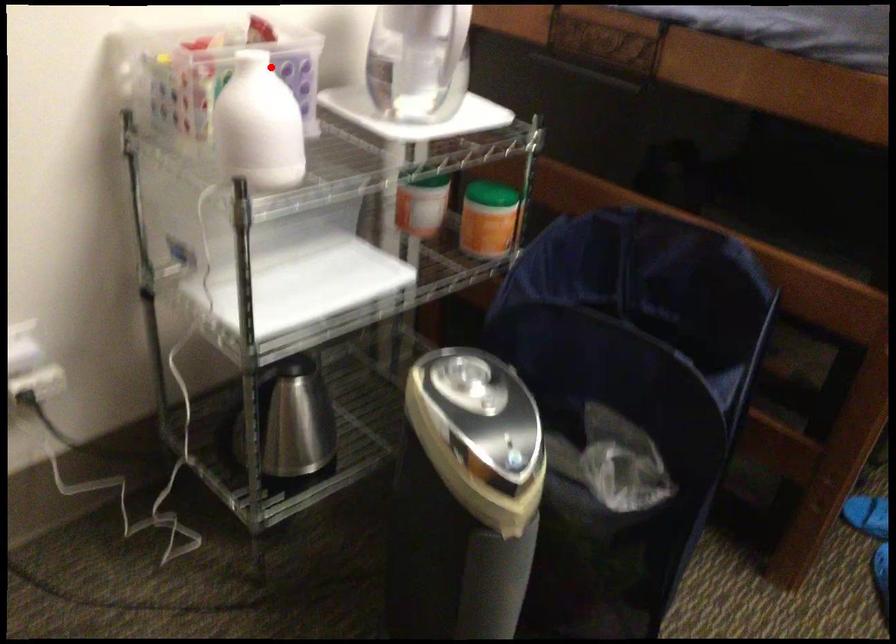
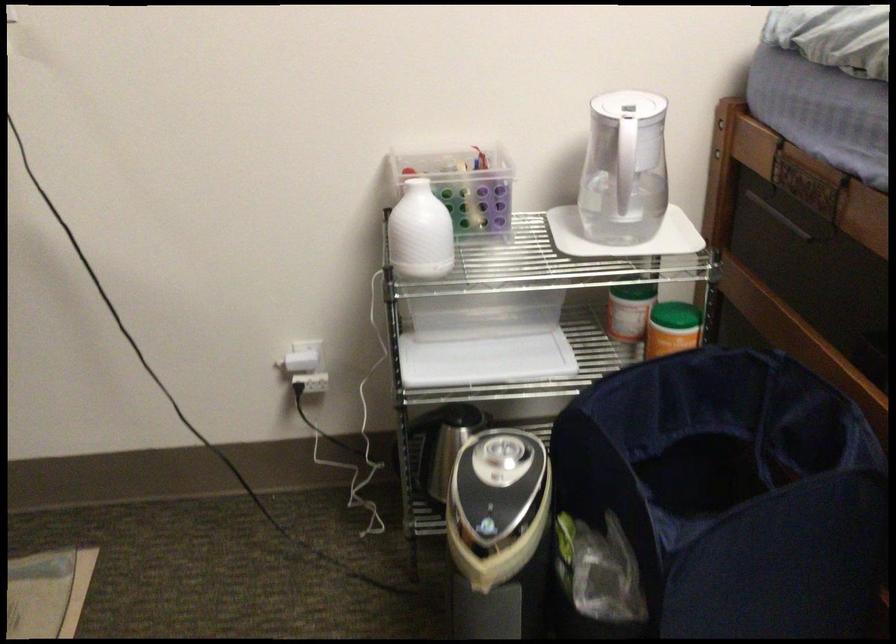
Question: I am providing you with two images of the same scene from different viewpoints. Image1 has a red point marked. In image2, the corresponding 3D location appears at what relative position? Reply with the corresponding letter.

Choices:
 (A) Closer
 (B) Farther

Answer: (B)